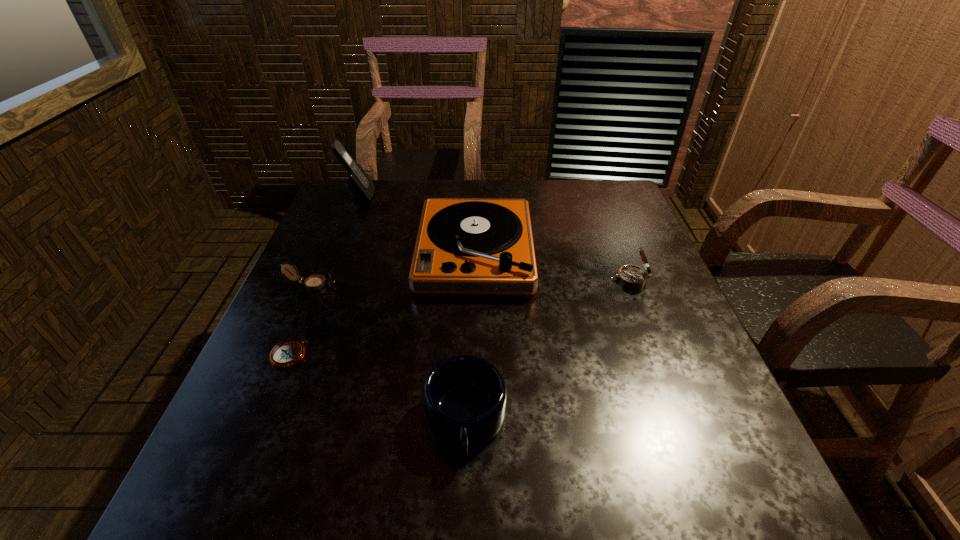
Where is `cellular telephone that is at the left edge`? cellular telephone that is at the left edge is located at coordinates (360, 186).

Locate an element on the screen. The width and height of the screenshot is (960, 540). object present at the right edge is located at coordinates (631, 276).

Where is `object at the far left corner`? This screenshot has width=960, height=540. object at the far left corner is located at coordinates (360, 186).

You are a GUI agent. You are given a task and a screenshot of the screen. Output one action in this format:
    pyautogui.click(x=<x>, y=<y>)
    Task: Click on the vacant area at the far edge of the desktop
    Image resolution: width=960 pixels, height=540 pixels.
    Given the screenshot: What is the action you would take?
    pyautogui.click(x=533, y=181)

What are the coordinates of `vacant area at the near edge of the desktop` in the screenshot? It's located at (323, 489).

Locate an element on the screen. The width and height of the screenshot is (960, 540). free space at the left edge is located at coordinates (318, 253).

The image size is (960, 540). In order to click on free spot at the right edge of the desktop in this screenshot , I will do `click(683, 407)`.

In the image, there is a desktop. At what (x,y) coordinates should I click in order to perform the action: click on blank space at the far right corner. Please return your answer as a coordinate pair (x, y). This screenshot has height=540, width=960. Looking at the image, I should click on (623, 207).

What are the coordinates of `vacant point located between the record player and the rightmost compass` in the screenshot? It's located at (552, 266).

Locate an element on the screen. Image resolution: width=960 pixels, height=540 pixels. free spot between the rightmost object and the record player is located at coordinates (552, 266).